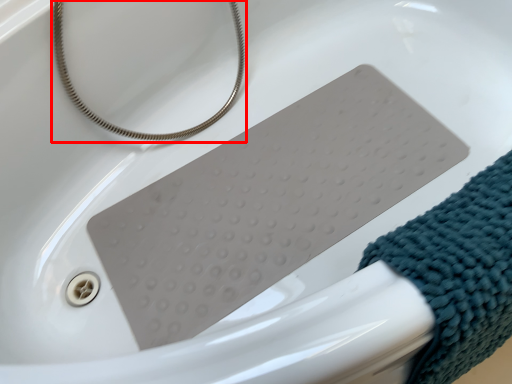
Question: From the image's perspective, where is string (annotated by the red box) located relative to wrap?

Choices:
 (A) above
 (B) below

Answer: (A)